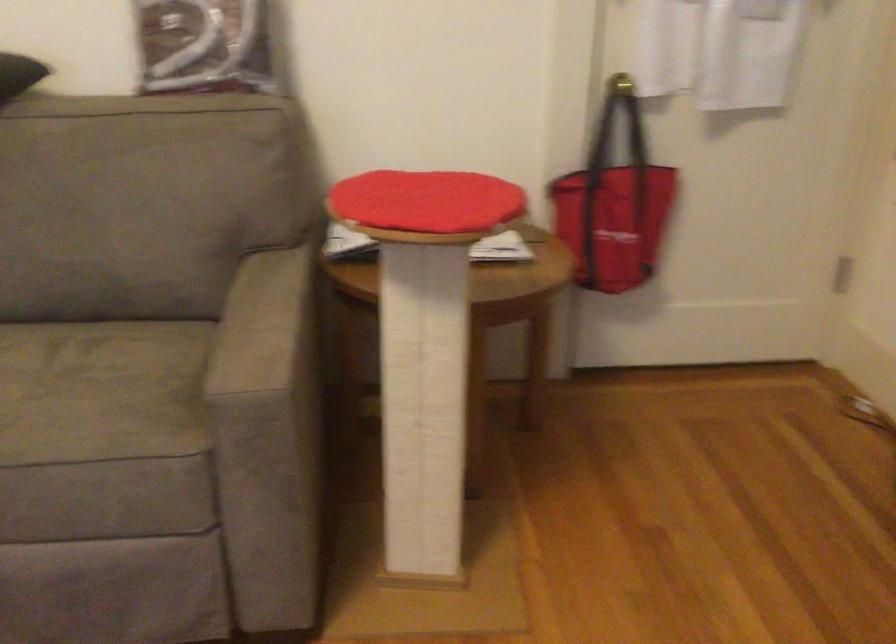
Where would you lift the black bag handles? Please return your answer as a coordinate pair (x, y).

(616, 124)